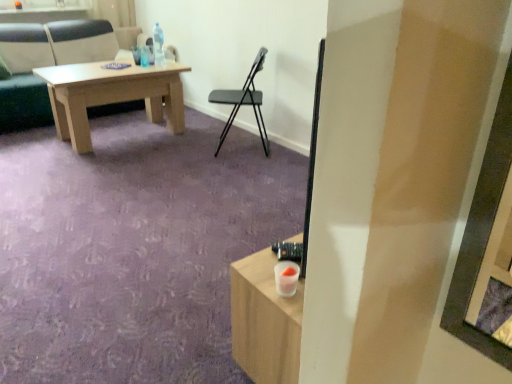
Where is `vacant region in front of black plastic chair at center, which ranks as the first chair in front-to-back order`? The height and width of the screenshot is (384, 512). vacant region in front of black plastic chair at center, which ranks as the first chair in front-to-back order is located at coordinates (242, 167).